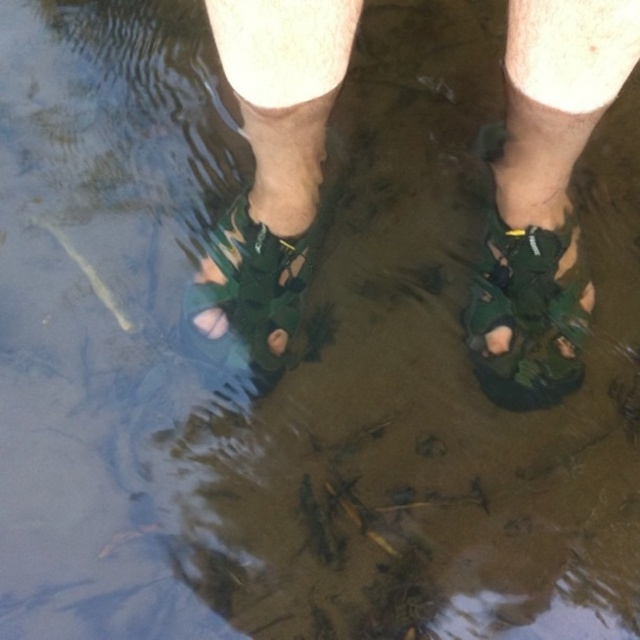
You are a photographer trying to capture the green fabric sandal at center in a closeup shot. The camera is positioned at the water surface level. Where should you aim the camera to ensure the sandal is centered in the frame?

The green fabric sandal at center is located at the 2D coordinates point (250, 291), so aim the camera at that point to center it in the frame.

You are a photographer trying to capture the green fabric sandal at center and the matte green sandal at lower center in a single shot. Which sandal will appear closer to the camera in the photo?

The green fabric sandal at center will appear closer to the camera in the photo because it is further to the viewer than the matte green sandal at lower center.